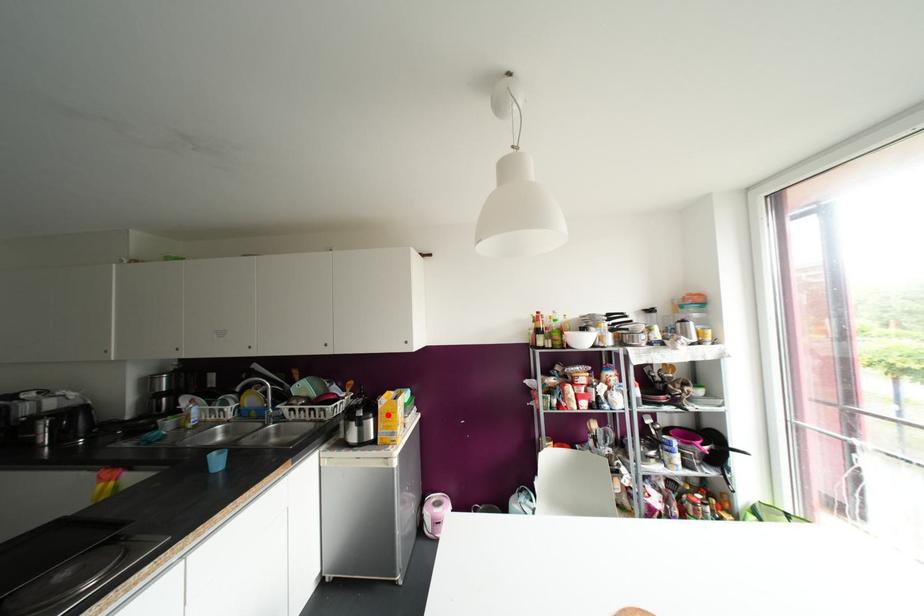
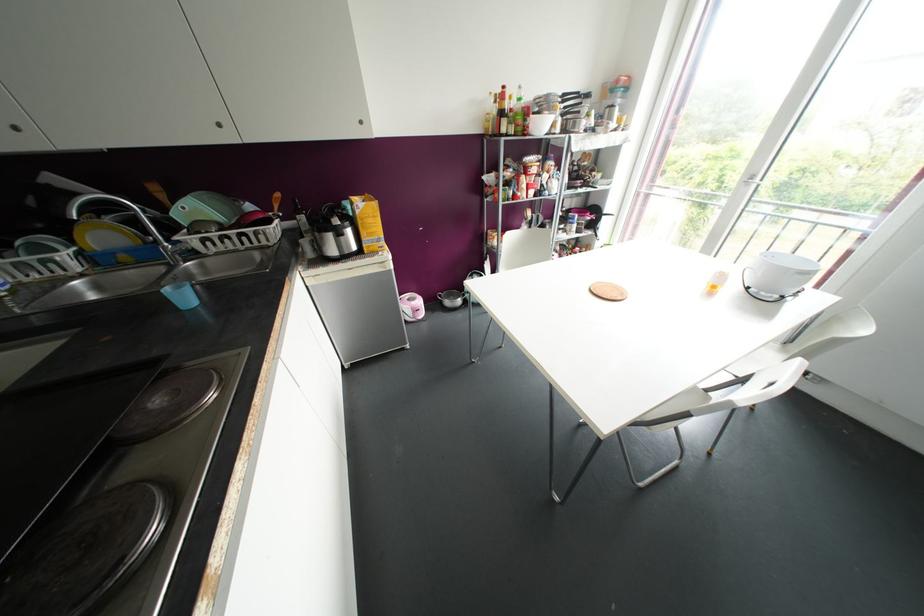
Question: I am providing you with two images of the same scene from different viewpoints. In image1, a red point is highlighted. Considering the same 3D point in image2, which of the following is correct?

Choices:
 (A) It is closer
 (B) It is farther

Answer: (A)